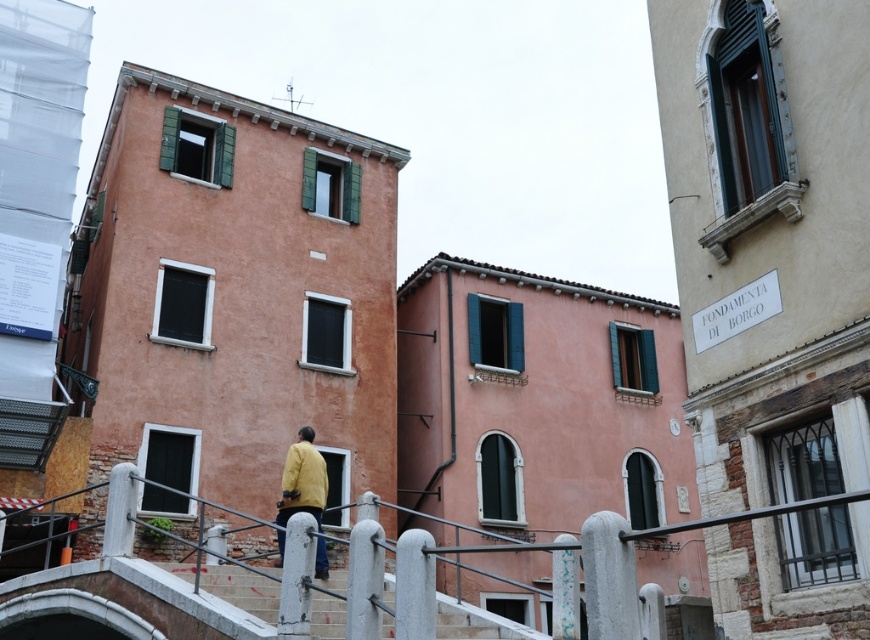
You are a tourist trying to cross the bridge in the scene. The white metal railing at lower center and the concrete stairs at lower center are in your path. Which of these two objects is wider? Please answer based on their widths.

The white metal railing at lower center is wider than the concrete stairs at lower center according to the description.